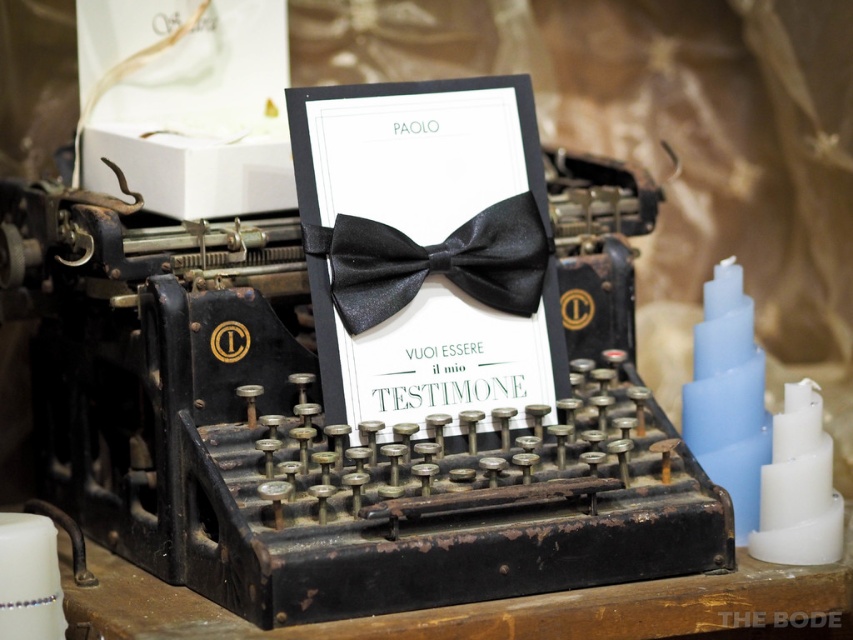
You are a decorator arranging items on a table. You have a black satin bow tie at center and a white matte candle at lower left. The table is 20 inches wide. Can both items fit side by side without overlapping?

The black satin bow tie at center is 17.66 inches away from the white matte candle at lower left. Since the table is 20 inches wide, there is enough space between them to fit both items side by side without overlapping.

You are organizing a formal event and need to place both the satin black bow tie at center and the white matte candle at lower left on a table. Given their sizes, which item should be placed first to ensure proper arrangement?

The satin black bow tie at center is larger in size than the white matte candle at lower left, so it should be placed first to accommodate its size before positioning the smaller candle.

You are organizing a formal event and have two bow ties on display. You see a satin black bow tie at center and a black satin bow tie at center. Which one is located to the right?

The satin black bow tie at center is positioned on the right side of the black satin bow tie at center.